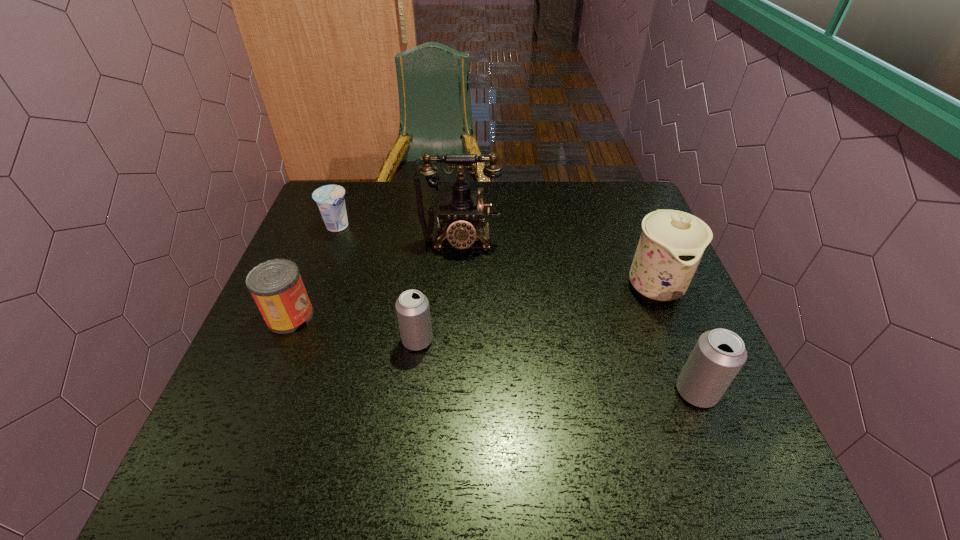
You are a GUI agent. You are given a task and a screenshot of the screen. Output one action in this format:
    pyautogui.click(x=<x>, y=<y>)
    Task: Click on the left beer can
    
    Given the screenshot: What is the action you would take?
    pyautogui.click(x=412, y=307)

Where is `the farther beer can`? The image size is (960, 540). the farther beer can is located at coordinates (412, 307).

Locate an element on the screen. the nearest object is located at coordinates pyautogui.click(x=719, y=354).

In order to click on the fourth shortest object in this screenshot , I will do `click(719, 354)`.

I want to click on can, so click(x=276, y=285).

You are a GUI agent. You are given a task and a screenshot of the screen. Output one action in this format:
    pyautogui.click(x=<x>, y=<y>)
    Task: Click on the shortest object
    The image size is (960, 540).
    Given the screenshot: What is the action you would take?
    pyautogui.click(x=330, y=199)

You are a GUI agent. You are given a task and a screenshot of the screen. Output one action in this format:
    pyautogui.click(x=<x>, y=<y>)
    Task: Click on the chinaware
    
    Given the screenshot: What is the action you would take?
    pyautogui.click(x=671, y=245)

Locate an element on the screen. This screenshot has width=960, height=540. the tallest object is located at coordinates (461, 209).

The height and width of the screenshot is (540, 960). What are the coordinates of `free spot located 0.130m on the back of the left beer can` in the screenshot? It's located at (424, 288).

This screenshot has width=960, height=540. In order to click on free spot located on the left of the nearer beer can in this screenshot , I will do `click(500, 392)`.